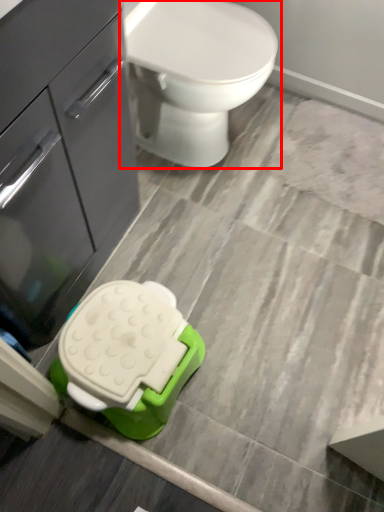
Question: In this image, where is toilet (annotated by the red box) located relative to bathroom cabinet?

Choices:
 (A) right
 (B) left

Answer: (A)